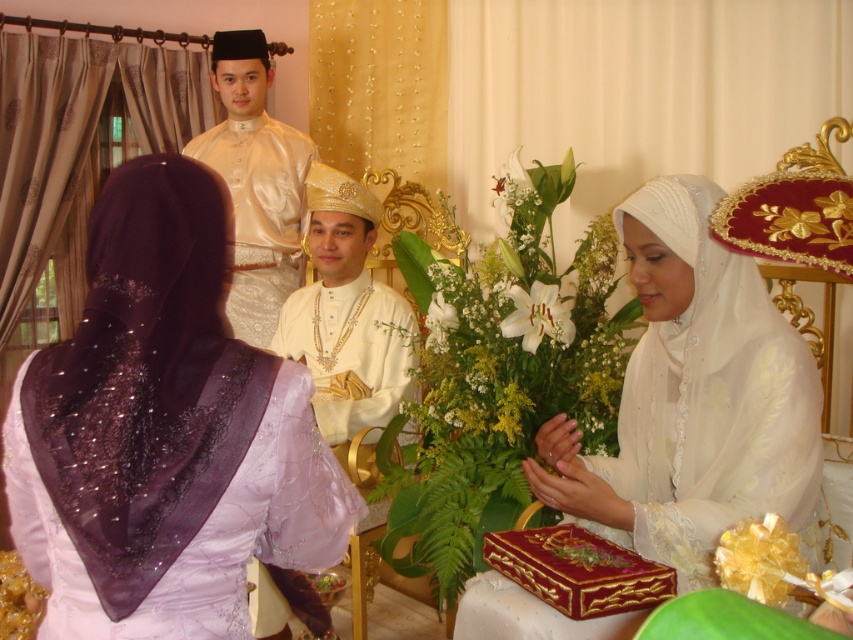
Does white silk bouquet at center appear on the left side of matte gold crown at center?

No, white silk bouquet at center is not to the left of matte gold crown at center.

Is white silk bouquet at center below matte gold crown at center?

Correct, white silk bouquet at center is located below matte gold crown at center.

Where is `white silk bouquet at center`? Image resolution: width=853 pixels, height=640 pixels. white silk bouquet at center is located at coordinates (497, 378).

This screenshot has width=853, height=640. I want to click on white silk bouquet at center, so pos(497,378).

Does white sheer veil at center have a smaller size compared to white silk bouquet at center?

Yes.

Measure the distance between white sheer veil at center and camera.

white sheer veil at center is 5.16 feet away from camera.

Is point (643, 371) positioned before point (595, 401)?

Yes, point (643, 371) is in front of point (595, 401).

Identify the location of white sheer veil at center. The width and height of the screenshot is (853, 640). (695, 400).

Looking at this image, how much distance is there between purple satin hijab at left and matte gold crown at center?

1.32 meters

Is purple satin hijab at left to the right of matte gold crown at center from the viewer's perspective?

No, purple satin hijab at left is not to the right of matte gold crown at center.

Where is `purple satin hijab at left`? The width and height of the screenshot is (853, 640). purple satin hijab at left is located at coordinates (164, 432).